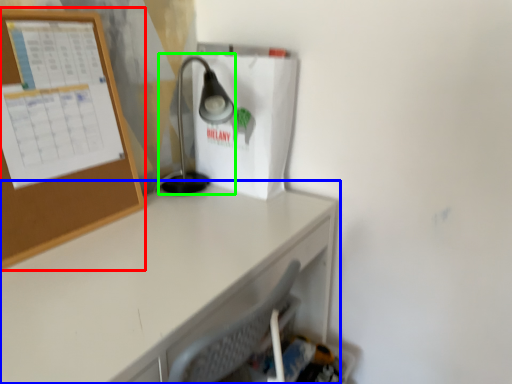
Question: Which is nearer to the bulletin board (highlighted by a red box)? desk (highlighted by a blue box) or lamp (highlighted by a green box).

Choices:
 (A) desk
 (B) lamp

Answer: (A)